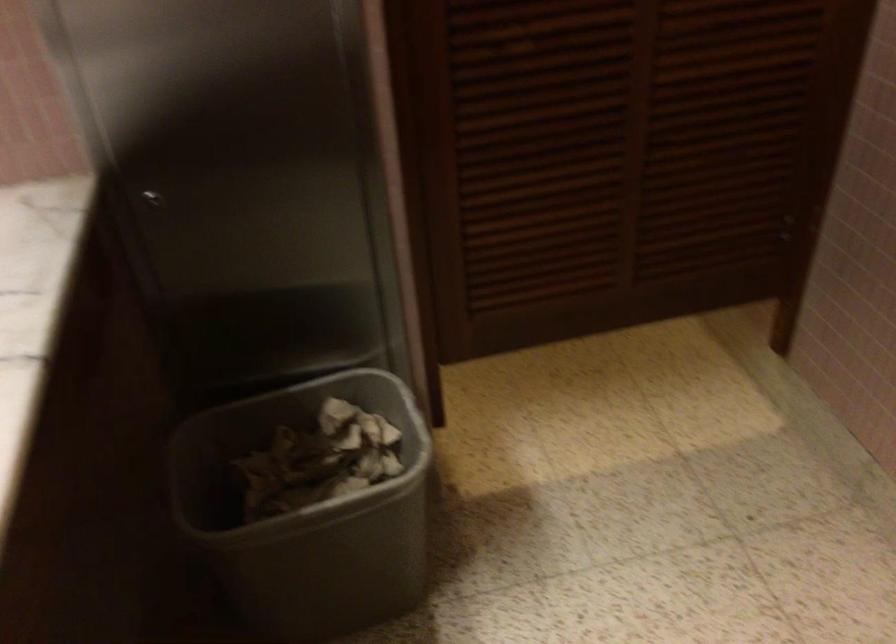
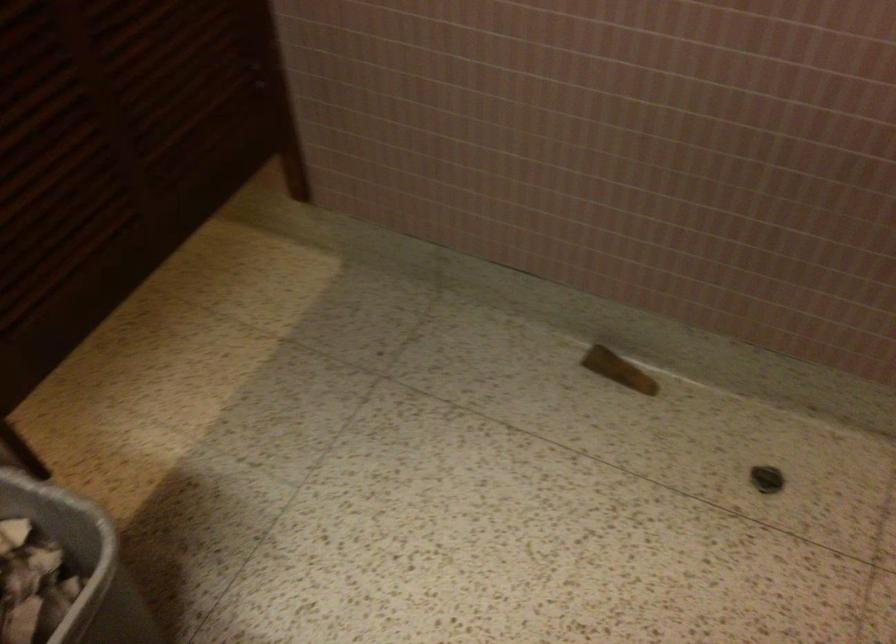
The point at (613,232) is marked in the first image. Where is the corresponding point in the second image?

(118, 158)